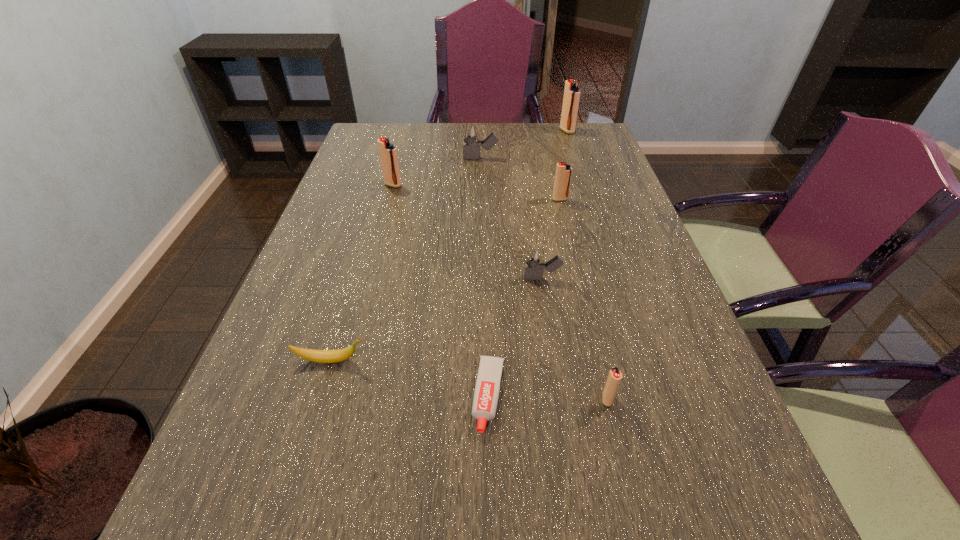
You are a GUI agent. You are given a task and a screenshot of the screen. Output one action in this format:
    pyautogui.click(x=<x>, y=<y>)
    Task: Click on the free spot located 0.250m on the back of the second nearest igniter
    The height and width of the screenshot is (540, 960).
    Given the screenshot: What is the action you would take?
    pyautogui.click(x=533, y=212)

I want to click on vacant region located at the stem of the yellow banana, so click(x=557, y=361).

In order to click on vacant area situated 0.290m on the left of the shortest object in this screenshot , I will do `click(313, 396)`.

Locate an element on the screen. Image resolution: width=960 pixels, height=540 pixels. igniter at the left edge is located at coordinates (388, 152).

The image size is (960, 540). I want to click on banana situated at the left edge, so [x=319, y=356].

The image size is (960, 540). Find the location of `object at the right edge`. object at the right edge is located at coordinates (571, 98).

At what (x,y) coordinates should I click in order to perform the action: click on object situated at the far right corner. Please return your answer as a coordinate pair (x, y). This screenshot has height=540, width=960. Looking at the image, I should click on (571, 98).

Locate an element on the screen. The image size is (960, 540). vacant region at the far edge is located at coordinates (500, 124).

Locate an element on the screen. The width and height of the screenshot is (960, 540). vacant area at the left edge is located at coordinates (336, 252).

Locate an element on the screen. This screenshot has height=540, width=960. free space at the right edge of the desktop is located at coordinates (590, 187).